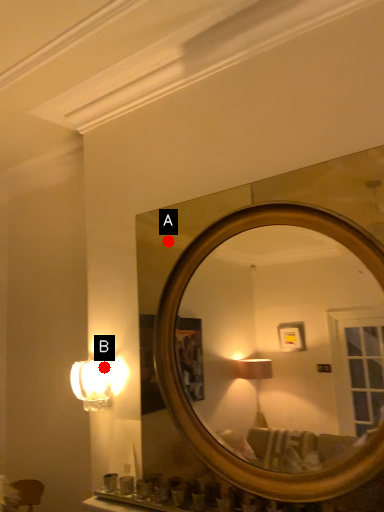
Question: Two points are circled on the image, labeled by A and B beside each circle. Among these points, which one is nearest to the camera?

Choices:
 (A) A is closer
 (B) B is closer

Answer: (A)